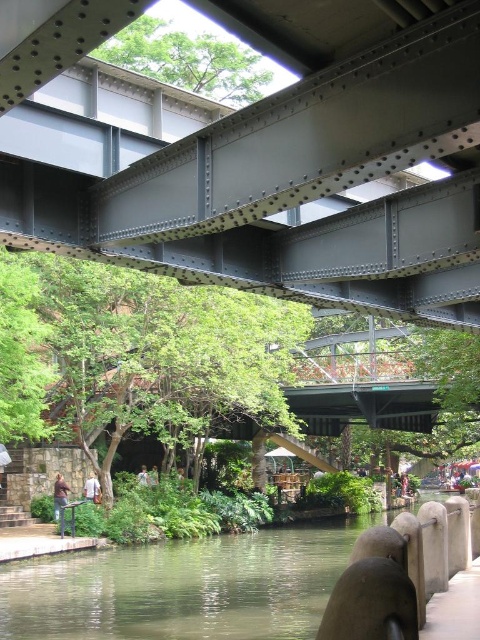
You are a pedestrian standing on the walkway near the canal. You see the green concrete river at lower center and the light brown hair at center. Which object is positioned to the right of the other?

The green concrete river at lower center is to the right of the light brown hair at center.

You are a photographer trying to capture the gray metallic bridge at upper center and the brown leather jacket at lower left in the same frame. Which object should you zoom in on to ensure both are visible without moving the camera?

You should zoom in on the brown leather jacket at lower left because the gray metallic bridge at upper center is thinner than it, so zooming in on the larger object allows both to fit in the frame.

You are a delivery person carrying a package and need to cross the canal. You see the gray metallic bridge at upper center and the brown leather jacket at lower left. Which object is positioned higher in the image?

The gray metallic bridge at upper center is located above the brown leather jacket at lower left, so it is positioned higher in the image.